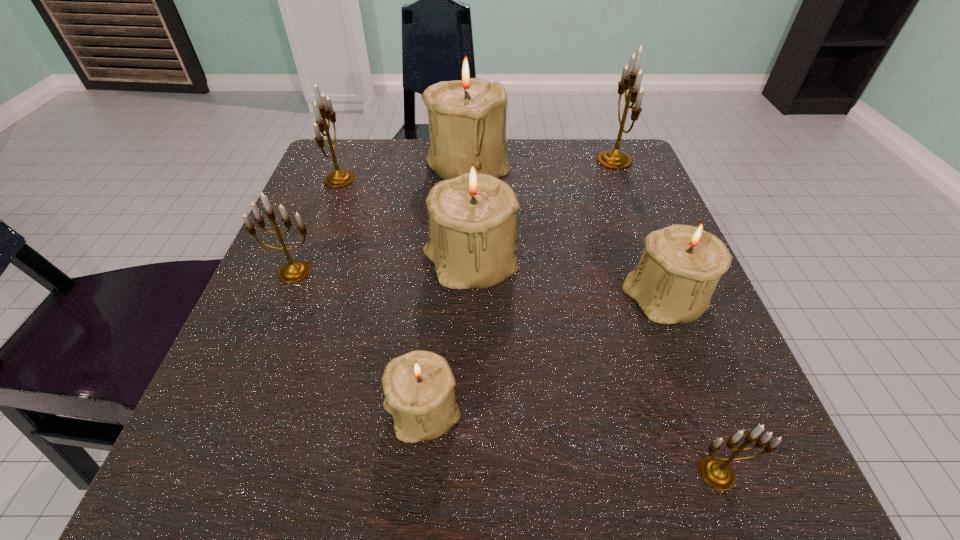
You are a GUI agent. You are given a task and a screenshot of the screen. Output one action in this format:
    pyautogui.click(x=<x>, y=<y>)
    Task: Click on the vacant space located on the front of the farthest beige candle_holder
    
    Given the screenshot: What is the action you would take?
    pyautogui.click(x=466, y=247)

The width and height of the screenshot is (960, 540). I want to click on vacant region located on the left of the biggest gold candelabrum, so click(553, 160).

This screenshot has width=960, height=540. Identify the location of free location located on the right of the third smallest beige candle_holder. (653, 264).

In order to click on free space located on the right of the third smallest gold candelabrum in this screenshot , I will do 396,179.

Where is `vacant space situated on the front of the second nearest gold candelabrum`? vacant space situated on the front of the second nearest gold candelabrum is located at coordinates (221, 453).

Where is `vacant area situated on the front of the rightmost beige candle_holder`? The width and height of the screenshot is (960, 540). vacant area situated on the front of the rightmost beige candle_holder is located at coordinates (720, 442).

This screenshot has width=960, height=540. Identify the location of free region located on the back of the smallest beige candle_holder. coord(441,225).

Locate an element on the screen. free space located 0.360m on the back of the nearest gold candelabrum is located at coordinates (638, 257).

You are a GUI agent. You are given a task and a screenshot of the screen. Output one action in this format:
    pyautogui.click(x=<x>, y=<y>)
    Task: Click on the object that is at the far left corner
    Image resolution: width=960 pixels, height=540 pixels.
    Given the screenshot: What is the action you would take?
    pyautogui.click(x=339, y=178)

The image size is (960, 540). In order to click on object that is at the far right corner in this screenshot , I will do `click(631, 78)`.